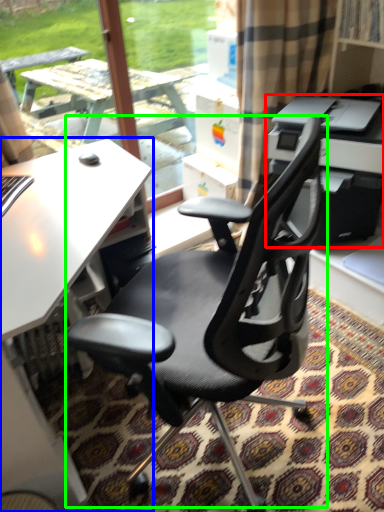
Question: Estimate the real-world distances between objects in this image. Which object is farther from printer (highlighted by a red box), desk (highlighted by a blue box) or chair (highlighted by a green box)?

Choices:
 (A) desk
 (B) chair

Answer: (A)